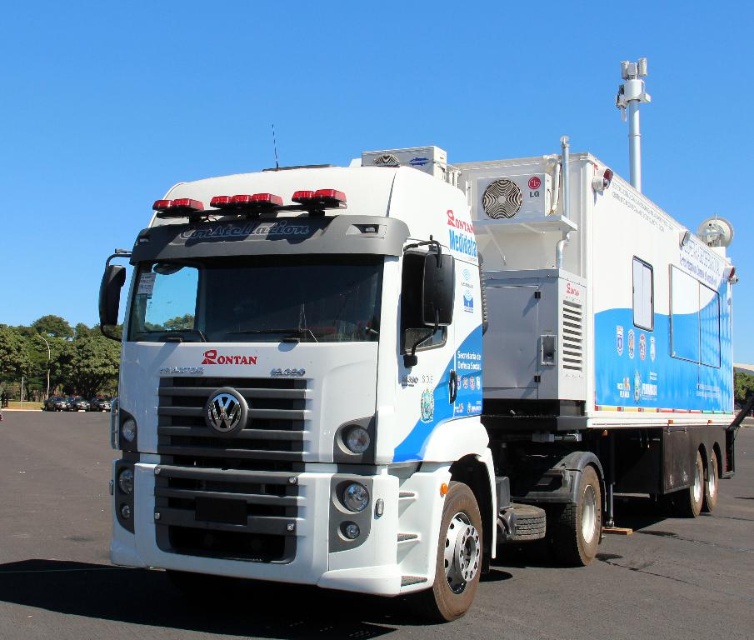
You are a delivery person standing 5 meters away from the white glossy trailer truck at center. You need to deliver a package to the driver inside the truck. Can you hand the package to them without moving closer?

The white glossy trailer truck at center is 4.99 meters away from camera. Since you are standing 5 meters away, you are slightly farther than the truck, so you cannot hand the package to the driver without moving closer.

You are a delivery person trying to park your van next to the white glossy trailer truck at center and the white glossy truck at center. What is the minimum distance you need to leave between your van and the two vehicles to safely pass through?

The white glossy trailer truck at center and the white glossy truck at center are 2.84 meters apart from each other. To safely pass through, you need to leave at least 2.84 meters between your van and the two vehicles.

You are a delivery person trying to park your van next to the white glossy truck at center and the white glossy trailer truck at center. Based on their heights, which one should you park closer to if you need to avoid hitting a low hanging tree branch that is 2 meters above the ground?

The white glossy truck at center is shorter than the white glossy trailer truck at center. Since the trailer truck is taller, you should park closer to the white glossy truck at center to avoid hitting the low hanging tree branch.